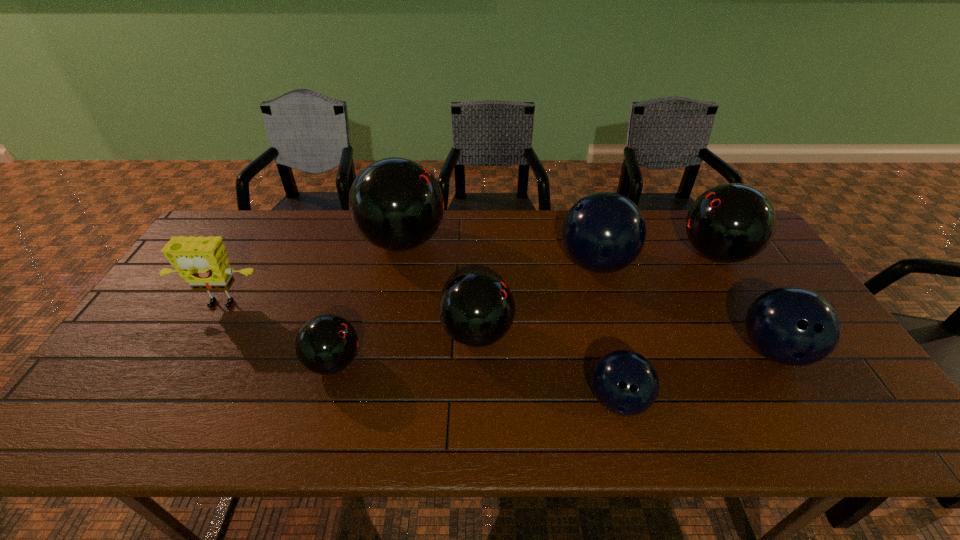
At what (x,y) coordinates should I click in order to perform the action: click on vacant space situated 0.060m on the surface of the rightmost blue bowling ball near the finger holes. Please return your answer as a coordinate pair (x, y). Looking at the image, I should click on (806, 405).

Identify the location of free space located 0.390m on the surface of the smallest black bowling ball near the finger holes. (519, 362).

Find the location of a particular element. object at the near edge is located at coordinates (624, 382).

In order to click on object that is at the left edge in this screenshot , I will do `click(201, 261)`.

At what (x,y) coordinates should I click in order to perform the action: click on object located in the far right corner section of the desktop. Please return your answer as a coordinate pair (x, y). Image resolution: width=960 pixels, height=540 pixels. Looking at the image, I should click on (729, 223).

At what (x,y) coordinates should I click in order to perform the action: click on vacant area at the far edge. Please return your answer as a coordinate pair (x, y). Looking at the image, I should click on (459, 252).

Where is `vacant space at the near edge`? The width and height of the screenshot is (960, 540). vacant space at the near edge is located at coordinates (293, 412).

The image size is (960, 540). In the image, there is a desktop. What are the coordinates of `vacant space at the right edge` in the screenshot? It's located at (743, 273).

This screenshot has width=960, height=540. Identify the location of free space at the far left corner of the desktop. (252, 231).

The image size is (960, 540). Identify the location of free space at the near left corner. (126, 439).